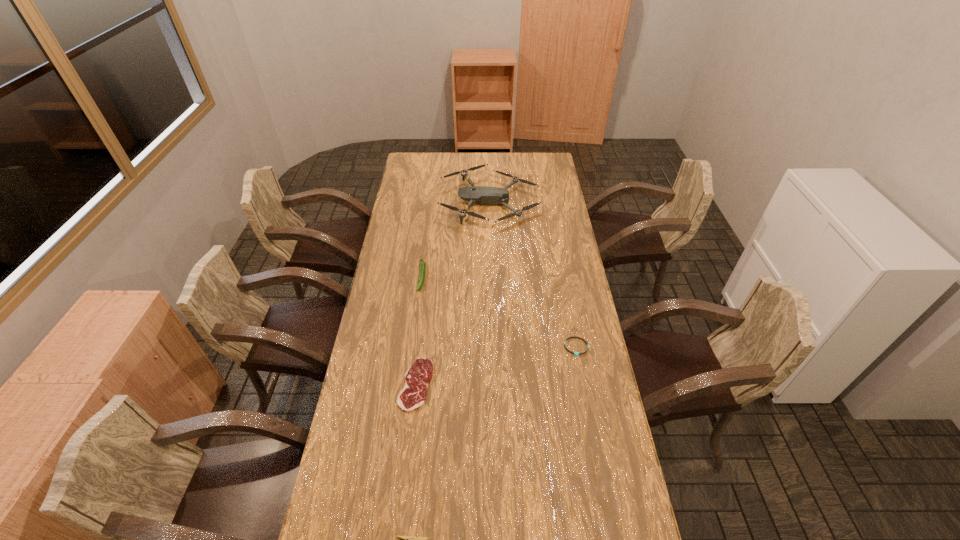
Locate an element on the screen. vacant space located on the right of the steak is located at coordinates (519, 384).

Find the location of a particular element. free region located on the buckle of the wristband is located at coordinates (591, 429).

Image resolution: width=960 pixels, height=540 pixels. Identify the location of object present at the far edge. (482, 195).

Where is `zucchini situated at the left edge`? The width and height of the screenshot is (960, 540). zucchini situated at the left edge is located at coordinates (422, 264).

This screenshot has width=960, height=540. I want to click on steak that is at the left edge, so click(x=418, y=377).

Locate an element on the screen. drone situated at the right edge is located at coordinates (482, 195).

Where is `wristband situated at the right edge`? This screenshot has height=540, width=960. wristband situated at the right edge is located at coordinates (575, 353).

Locate an element on the screen. object located in the far right corner section of the desktop is located at coordinates (482, 195).

Locate an element on the screen. The height and width of the screenshot is (540, 960). free region at the far edge of the desktop is located at coordinates (482, 173).

What are the coordinates of `free space at the left edge of the desktop` in the screenshot? It's located at (380, 400).